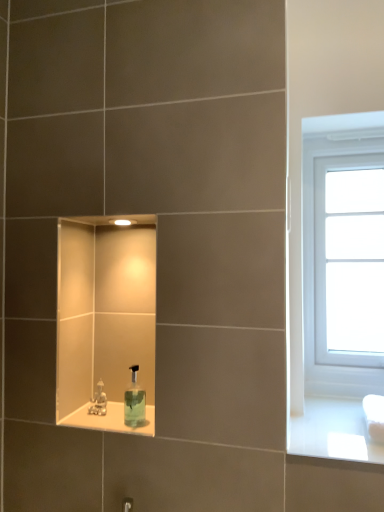
The height and width of the screenshot is (512, 384). What are the coordinates of `vacant region to the left of transparent plastic soap dispenser at center` in the screenshot? It's located at (98, 424).